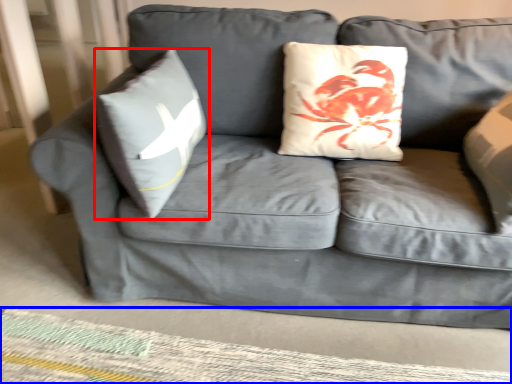
Question: Which point is further to the camera, pillow (highlighted by a red box) or mat (highlighted by a blue box)?

Choices:
 (A) pillow
 (B) mat

Answer: (B)